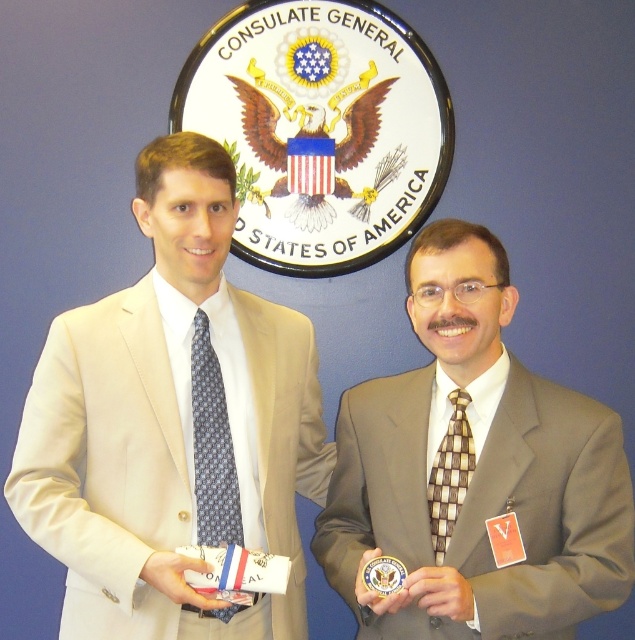
Question: Observing the image, what is the correct spatial positioning of beige fabric suit at left in reference to brown textured suit at center?

Choices:
 (A) above
 (B) below

Answer: (A)

Question: Can you confirm if beige fabric suit at left is positioned above brown textured suit at center?

Choices:
 (A) no
 (B) yes

Answer: (B)

Question: Estimate the real-world distances between objects in this image. Which object is farther from the beige fabric suit at left?

Choices:
 (A) brown textured suit at center
 (B) blue printed tie at center
 (C) checkerboard-patterned tie at center

Answer: (C)

Question: Which object is farther from the camera taking this photo?

Choices:
 (A) beige fabric suit at left
 (B) checkerboard-patterned tie at center
 (C) blue printed tie at center
 (D) brown textured suit at center

Answer: (C)

Question: Which point appears farthest from the camera in this image?

Choices:
 (A) (204, 387)
 (B) (551, 492)
 (C) (462, 397)

Answer: (A)

Question: Does beige fabric suit at left appear on the left side of checkerboard-patterned tie at center?

Choices:
 (A) yes
 (B) no

Answer: (A)